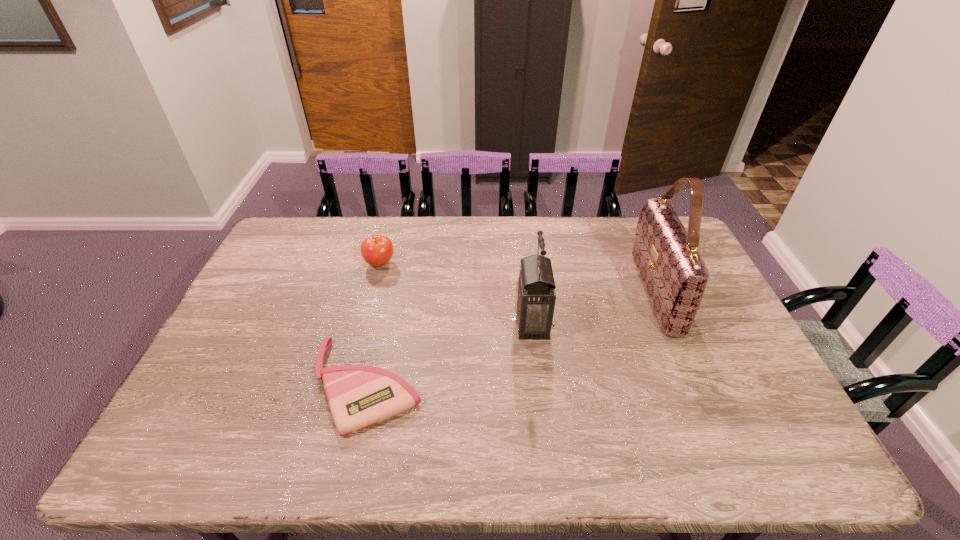
You are a GUI agent. You are given a task and a screenshot of the screen. Output one action in this format:
    pyautogui.click(x=<x>, y=<y>)
    Task: Click on the free spot located on the front-facing side of the second tallest object
    The image size is (960, 540).
    Given the screenshot: What is the action you would take?
    tap(434, 324)

Locate an element on the screen. vacant position located 0.110m on the front-facing side of the second tallest object is located at coordinates (477, 324).

This screenshot has height=540, width=960. I want to click on vacant space located on the front of the second shortest object, so click(353, 364).

The width and height of the screenshot is (960, 540). Find the location of `vacant position located on the right of the shortest object`. vacant position located on the right of the shortest object is located at coordinates (466, 385).

Where is `handbag situated at the far edge`? Image resolution: width=960 pixels, height=540 pixels. handbag situated at the far edge is located at coordinates 675,276.

Find the location of a particular element. apple present at the far edge is located at coordinates (377, 250).

Find the location of a particular element. The image size is (960, 540). object positioned at the near edge is located at coordinates (359, 396).

Where is `object that is at the right edge`? Image resolution: width=960 pixels, height=540 pixels. object that is at the right edge is located at coordinates tap(675, 276).

At what (x,y) coordinates should I click in order to perform the action: click on object at the far right corner. Please return your answer as a coordinate pair (x, y). Looking at the image, I should click on (675, 276).

Locate an element on the screen. The width and height of the screenshot is (960, 540). free region at the far edge of the desktop is located at coordinates (586, 242).